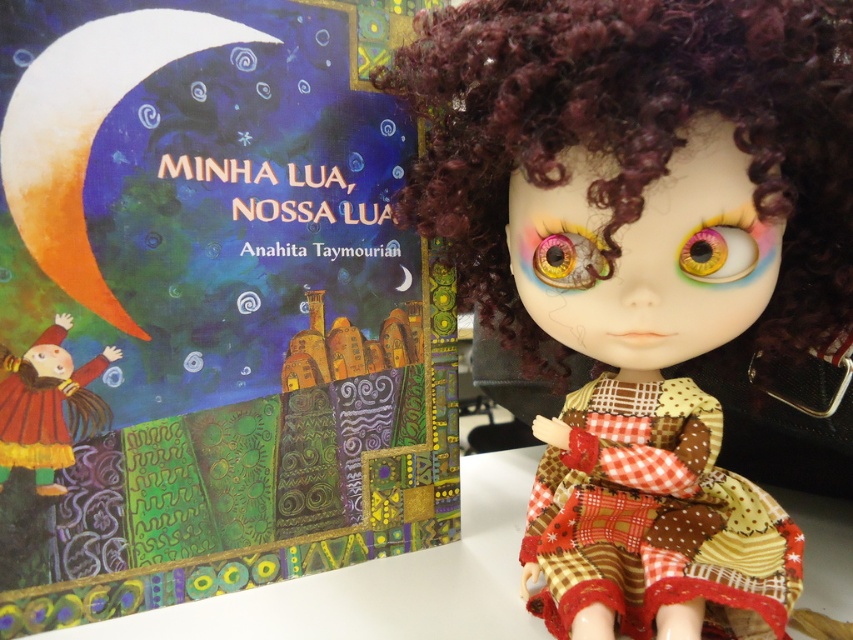
Is point (584, 81) farther from viewer compared to point (723, 278)?

No, it is not.

Which of these two, curly brown hair at upper right or multicolored glass eye at upper center, stands taller?

curly brown hair at upper right

What do you see at coordinates (634, 131) in the screenshot? The image size is (853, 640). I see `curly brown hair at upper right` at bounding box center [634, 131].

What are the coordinates of `curly brown hair at upper right` in the screenshot? It's located at (634, 131).

Is point (434, 422) behind point (604, 252)?

That is True.

Is matte paper book at upper left above curly brown hair at upper right?

No.

This screenshot has height=640, width=853. I want to click on matte paper book at upper left, so click(209, 305).

Is point (469, 3) closer to camera compared to point (9, 394)?

Yes, it is in front of point (9, 394).

Is curly brown hair at upper right wider than matte yellow dress at lower left?

Correct, the width of curly brown hair at upper right exceeds that of matte yellow dress at lower left.

Does point (798, 136) lie behind point (73, 392)?

No, (798, 136) is closer to viewer.

Where is `curly brown hair at upper right`? curly brown hair at upper right is located at coordinates (634, 131).